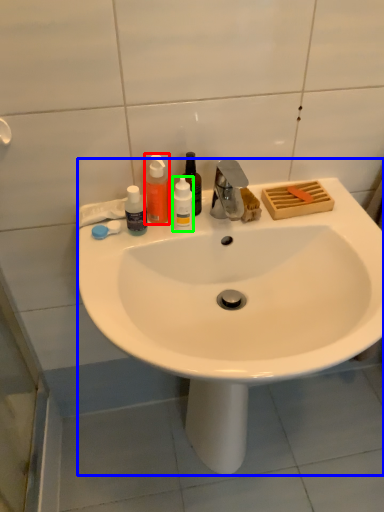
Question: Which is farther away from bottle (highlighted by a red box)? sink (highlighted by a blue box) or bottle (highlighted by a green box)?

Choices:
 (A) sink
 (B) bottle

Answer: (A)